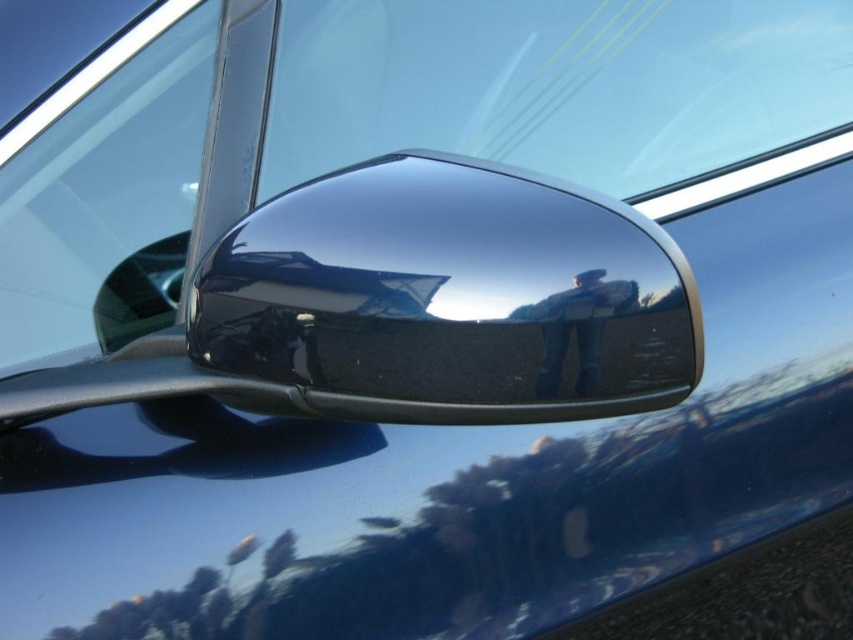
Does point (189, 115) come in front of point (65, 451)?

No, (189, 115) is further to viewer.

Identify the location of transparent glass car window at upper left. (102, 189).

The width and height of the screenshot is (853, 640). I want to click on transparent glass car window at upper left, so click(102, 189).

Find the location of a particular element. This screenshot has width=853, height=640. transparent glass car window at upper left is located at coordinates (102, 189).

Consider the image. Is glossy chrome mirror at center positioned in front of glossy chrome side mirror at lower left?

Yes, it is in front of glossy chrome side mirror at lower left.

This screenshot has width=853, height=640. What do you see at coordinates (447, 300) in the screenshot? I see `glossy chrome mirror at center` at bounding box center [447, 300].

At what (x,y) coordinates should I click in order to perform the action: click on glossy chrome mirror at center. Please return your answer as a coordinate pair (x, y). Looking at the image, I should click on (447, 300).

Between glossy chrome mirror at center and transparent glass car window at upper left, which one appears on the left side from the viewer's perspective?

From the viewer's perspective, transparent glass car window at upper left appears more on the left side.

Is glossy chrome mirror at center further to camera compared to transparent glass car window at upper left?

No, glossy chrome mirror at center is in front of transparent glass car window at upper left.

This screenshot has height=640, width=853. I want to click on glossy chrome mirror at center, so click(447, 300).